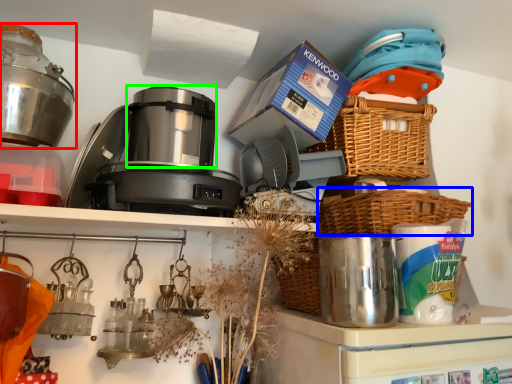
Question: Based on their relative distances, which object is farther from kitchen appliance (highlighted by a red box)? Choose from basket (highlighted by a blue box) and appliance (highlighted by a green box).

Choices:
 (A) basket
 (B) appliance

Answer: (A)